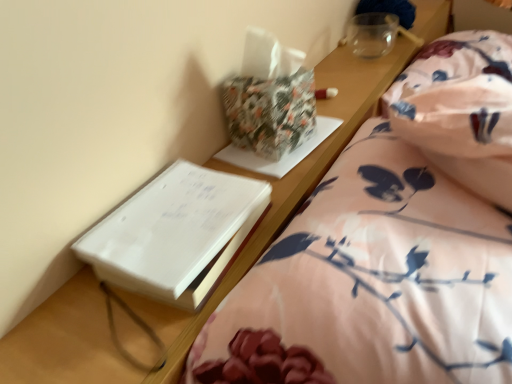
You are a GUI agent. You are given a task and a screenshot of the screen. Output one action in this format:
    pyautogui.click(x=<x>, y=<y>)
    Task: Click on the blank space above white paper at left (from a real-world perspective)
    The width and height of the screenshot is (512, 384).
    Given the screenshot: What is the action you would take?
    pyautogui.click(x=170, y=208)